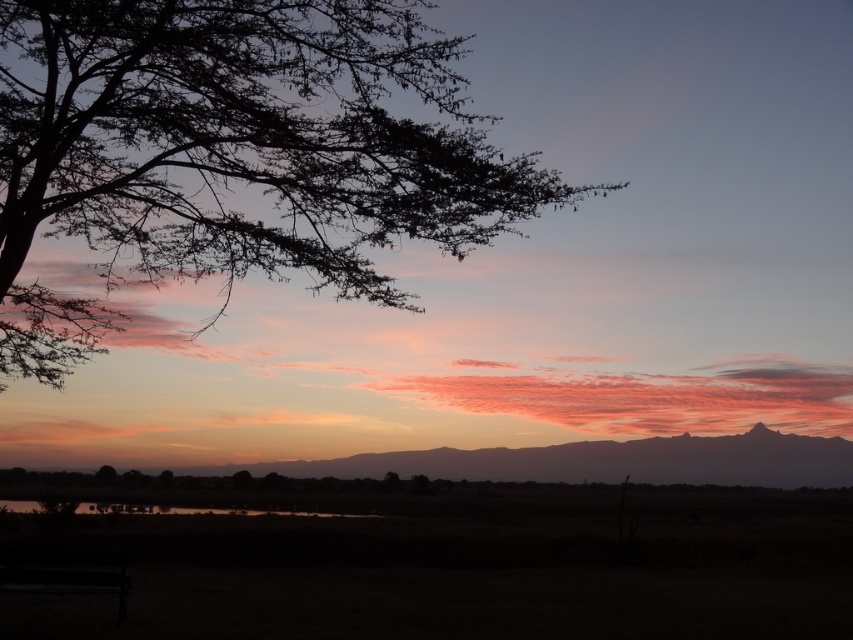
You are an artist trying to paint the sunset scene. You want to ensure the smooth water at lower center reflects the silky purple sky at center accurately. Based on their positions, can you determine if the reflection will be visible on the water?

The smooth water at lower center is behind the silky purple sky at center, so the reflection of the silky purple sky at center would not be visible on the smooth water at lower center because the sky is in front of the water.

You are a photographer trying to capture the sunset reflection on the water. You notice the silhouette leafy tree at upper left and the smooth water at lower center. Which object is closer to the camera, making it harder to get a clear reflection shot?

The silhouette leafy tree at upper left is in front of the smooth water at lower center, so it is closer to the camera and may obstruct the reflection shot.